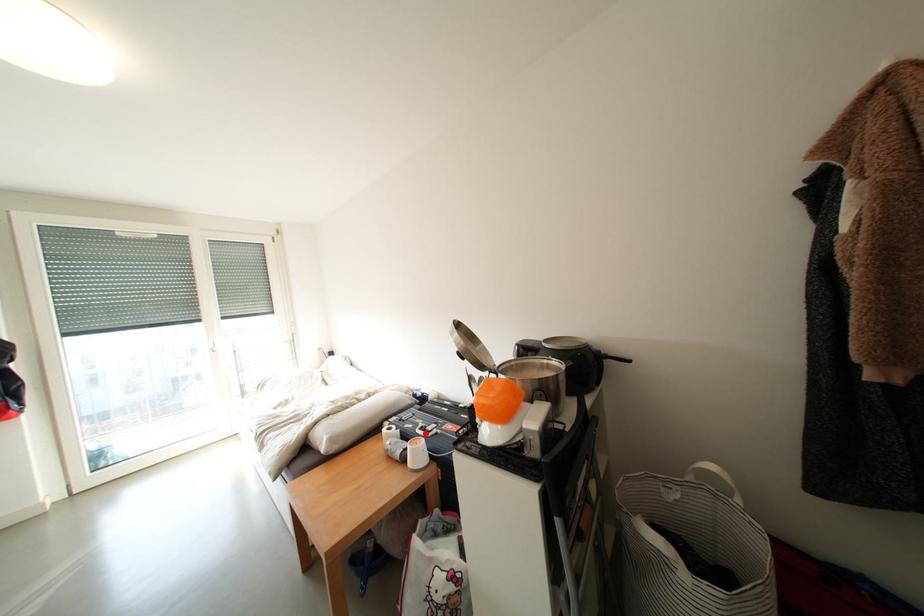
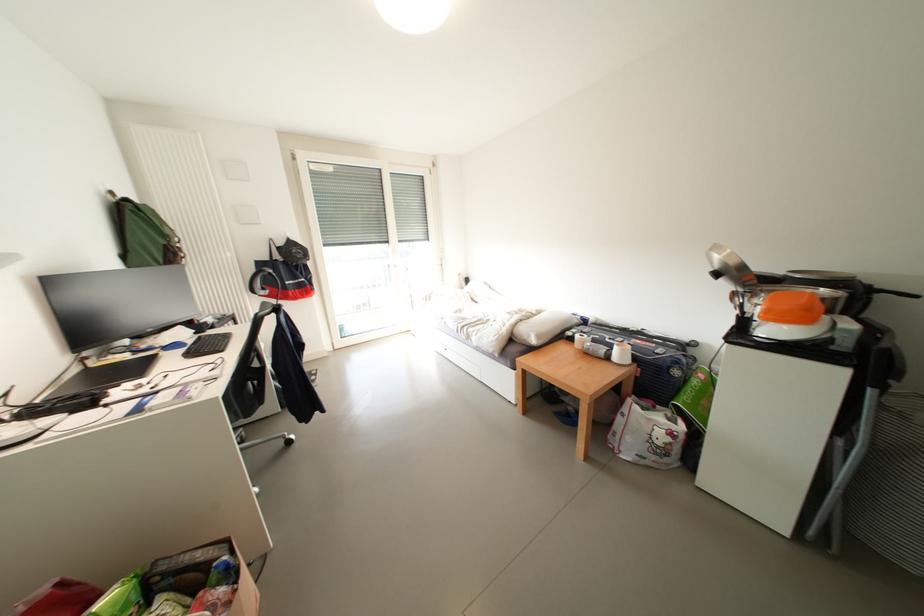
Question: I am providing you with two images of the same scene from different viewpoints. Image1 has a red point marked. In image2, the corresponding 3D location appears at what relative position? Reply with the corresponding letter.

Choices:
 (A) Closer
 (B) Farther

Answer: (B)